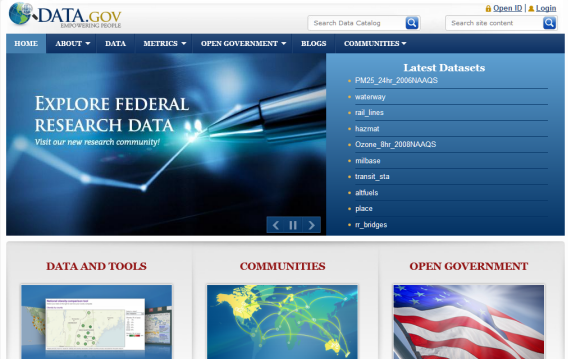
This screenshot has width=568, height=359. In order to click on globe in this screenshot , I will do `click(22, 11)`.